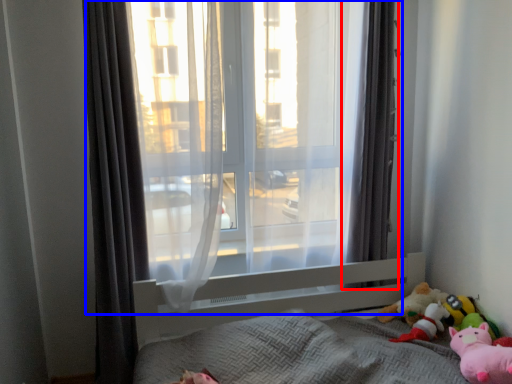
Question: Which object is closer to the camera taking this photo, curtain (highlighted by a red box) or window (highlighted by a blue box)?

Choices:
 (A) curtain
 (B) window

Answer: (B)